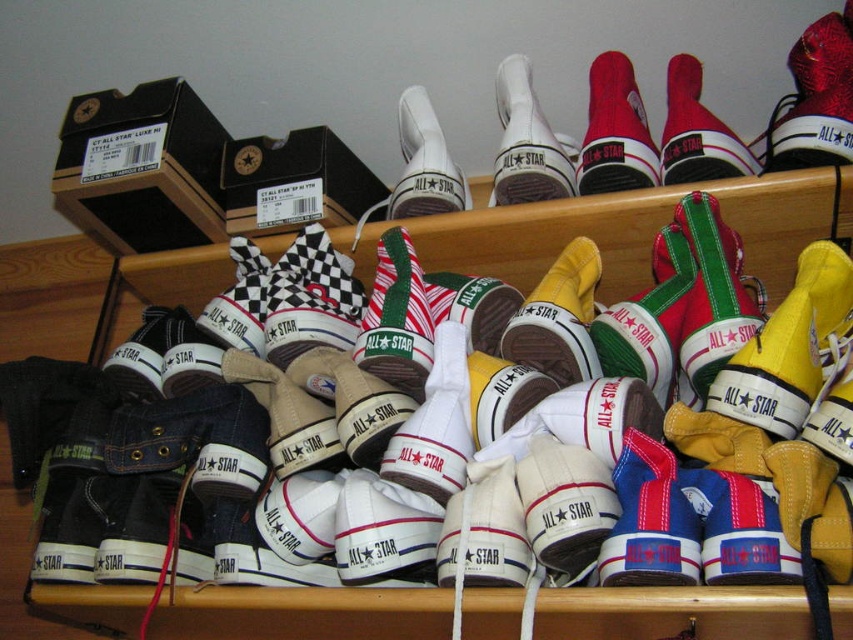
Question: Can you confirm if green canvas sneaker at center is bigger than red canvas sneaker at upper center?

Choices:
 (A) yes
 (B) no

Answer: (B)

Question: Does white canvas shoes at upper center appear on the right side of matte black sneaker at upper right?

Choices:
 (A) no
 (B) yes

Answer: (A)

Question: Considering the real-world distances, which object is closest to the white canvas shoe at center?

Choices:
 (A) matte black sneaker at upper right
 (B) black cardboard box at upper center

Answer: (B)

Question: Does white canvas shoes at upper center have a greater width compared to black cardboard box at upper center?

Choices:
 (A) yes
 (B) no

Answer: (A)

Question: Which of the following is the farthest from the observer?

Choices:
 (A) red canvas sneaker at upper right
 (B) matte black sneaker at upper right
 (C) black cardboard box at upper center

Answer: (C)

Question: Which of the following is the farthest from the observer?

Choices:
 (A) (532, 196)
 (B) (80, 102)
 (C) (805, 145)

Answer: (B)